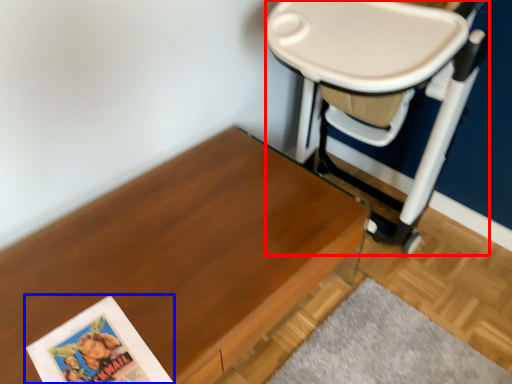
Question: Which of the following is the farthest to the observer, swivel chair (highlighted by a red box) or paperback book (highlighted by a blue box)?

Choices:
 (A) swivel chair
 (B) paperback book

Answer: (B)